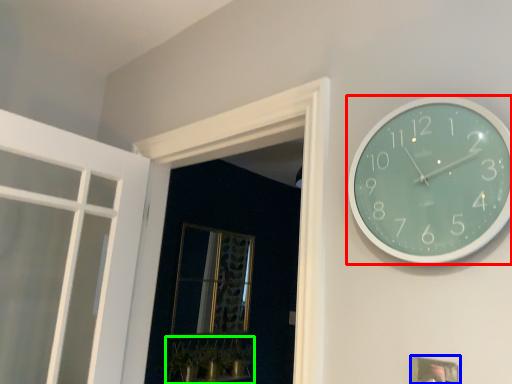
Question: Which object is positioned farthest from wall clock (highlighted by a red box)? Select from picture frame (highlighted by a blue box) and plant (highlighted by a green box).

Choices:
 (A) picture frame
 (B) plant

Answer: (B)